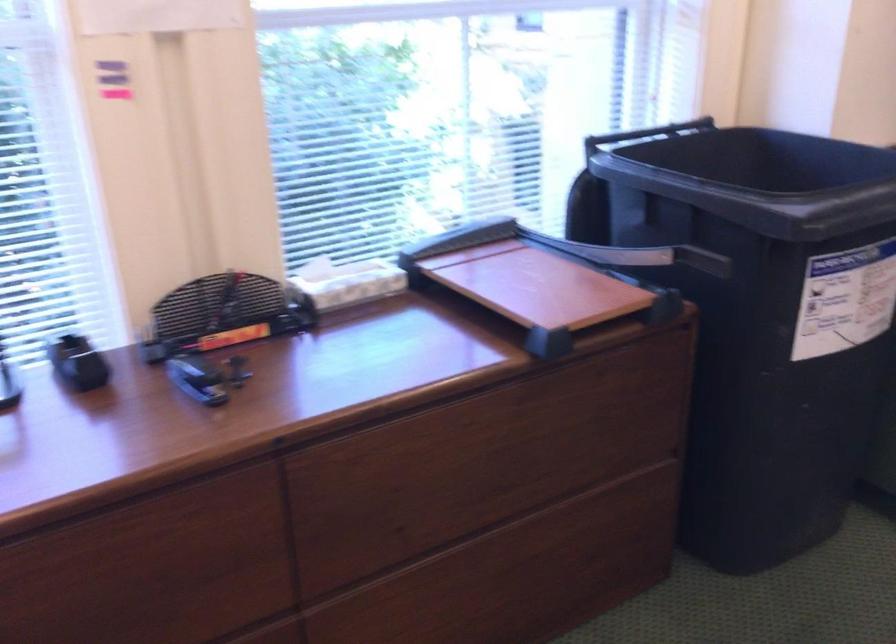
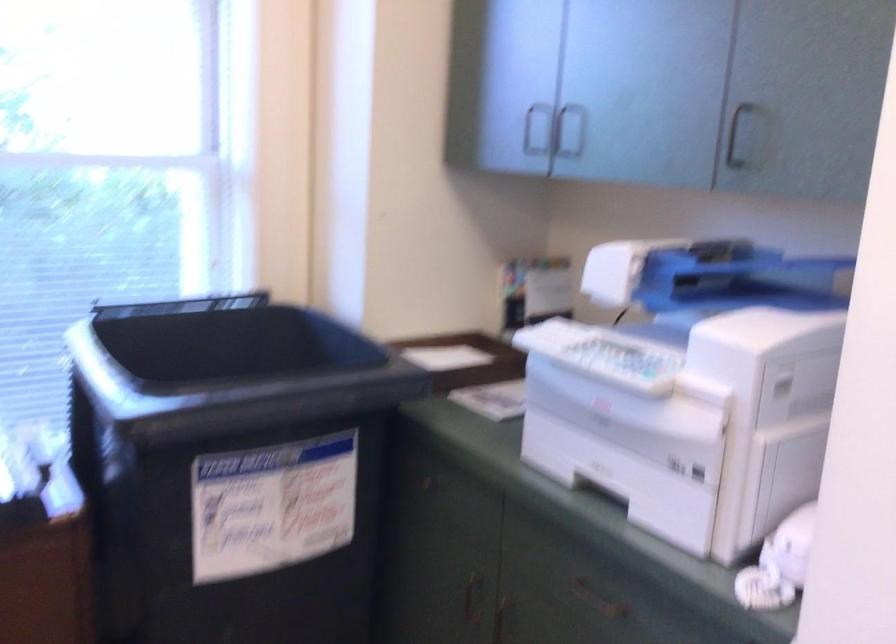
Question: How did the camera likely rotate?

Choices:
 (A) Left
 (B) Right
 (C) Up
 (D) Down

Answer: (C)